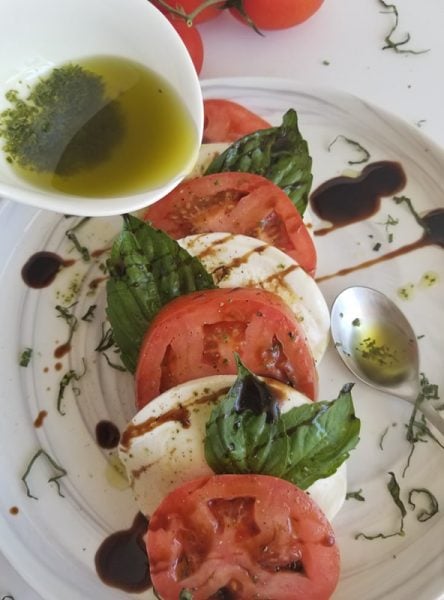
Locate an element on the screen. The height and width of the screenshot is (600, 444). white bowl  holding sauce is located at coordinates (80, 27).